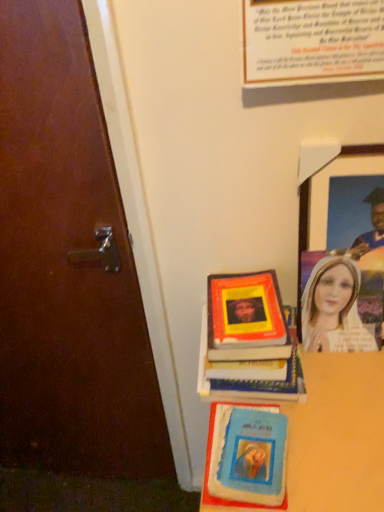
Find the location of a particular element. The image size is (384, 512). free spot to the right of hardcover book at center is located at coordinates (340, 376).